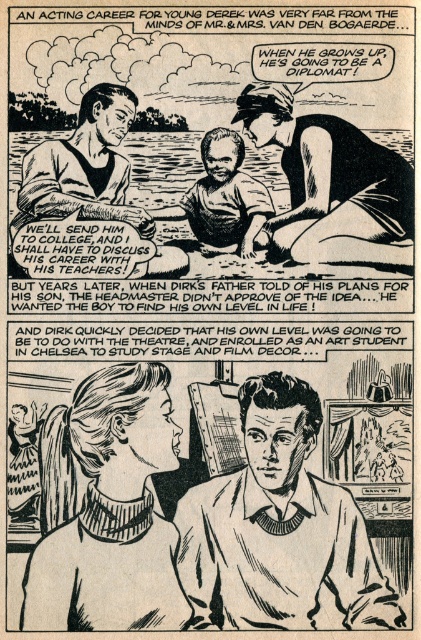
Question: Estimate the real-world distances between objects in this image. Which object is farther from the smooth navy sailor suit at upper center?

Choices:
 (A) smooth skin man at center
 (B) smooth sweater at center
 (C) smooth brown shirt at center
 (D) knitted turtleneck sweater at center

Answer: (B)

Question: Does smooth skin man at center appear over smooth navy sailor suit at upper center?

Choices:
 (A) yes
 (B) no

Answer: (A)

Question: Does smooth sweater at center appear under smooth skin man at center?

Choices:
 (A) no
 (B) yes

Answer: (B)

Question: Which point is closer to the camera?

Choices:
 (A) (255, 236)
 (B) (263, 548)
 (C) (404, 250)

Answer: (B)

Question: Is smooth sweater at center positioned behind smooth skin man at center?

Choices:
 (A) yes
 (B) no

Answer: (B)

Question: Which object is closer to the camera taking this photo?

Choices:
 (A) smooth brown shirt at center
 (B) smooth skin man at center
 (C) smooth sweater at center

Answer: (C)